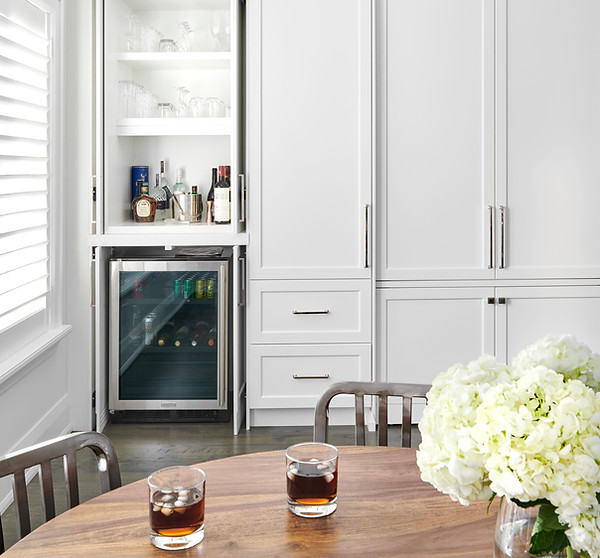
Locate an element on the screen. The image size is (600, 558). blinds is located at coordinates (7, 246).